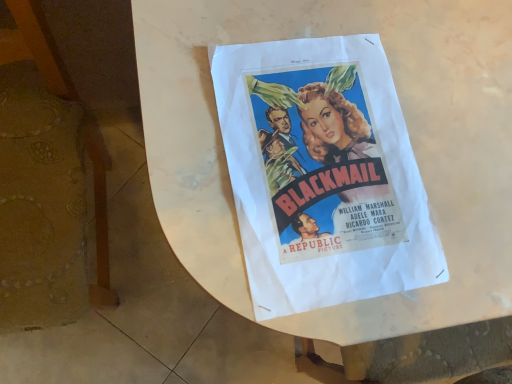
Question: From a real-world perspective, is wooden chair at left below matte paper poster at center?

Choices:
 (A) no
 (B) yes

Answer: (B)

Question: Is wooden chair at left far from matte paper poster at center?

Choices:
 (A) yes
 (B) no

Answer: (B)

Question: Considering the relative sizes of wooden chair at left and matte paper poster at center in the image provided, is wooden chair at left wider than matte paper poster at center?

Choices:
 (A) yes
 (B) no

Answer: (A)

Question: Is wooden chair at left smaller than matte paper poster at center?

Choices:
 (A) yes
 (B) no

Answer: (B)

Question: Could you tell me if wooden chair at left is facing matte paper poster at center?

Choices:
 (A) yes
 (B) no

Answer: (B)

Question: Is wooden chair at left touching matte paper poster at center?

Choices:
 (A) no
 (B) yes

Answer: (A)

Question: Is matte paper poster at center bigger than white paper at center?

Choices:
 (A) no
 (B) yes

Answer: (A)

Question: From the image's perspective, is matte paper poster at center over white paper at center?

Choices:
 (A) no
 (B) yes

Answer: (A)

Question: Can you confirm if matte paper poster at center is positioned to the right of white paper at center?

Choices:
 (A) yes
 (B) no

Answer: (B)

Question: Can you confirm if matte paper poster at center is thinner than white paper at center?

Choices:
 (A) yes
 (B) no

Answer: (A)

Question: Considering the relative positions of matte paper poster at center and white paper at center in the image provided, is matte paper poster at center to the left of white paper at center from the viewer's perspective?

Choices:
 (A) no
 (B) yes

Answer: (B)

Question: From a real-world perspective, is matte paper poster at center below white paper at center?

Choices:
 (A) no
 (B) yes

Answer: (A)

Question: From a real-world perspective, does matte paper poster at center stand above wooden chair at left?

Choices:
 (A) yes
 (B) no

Answer: (A)